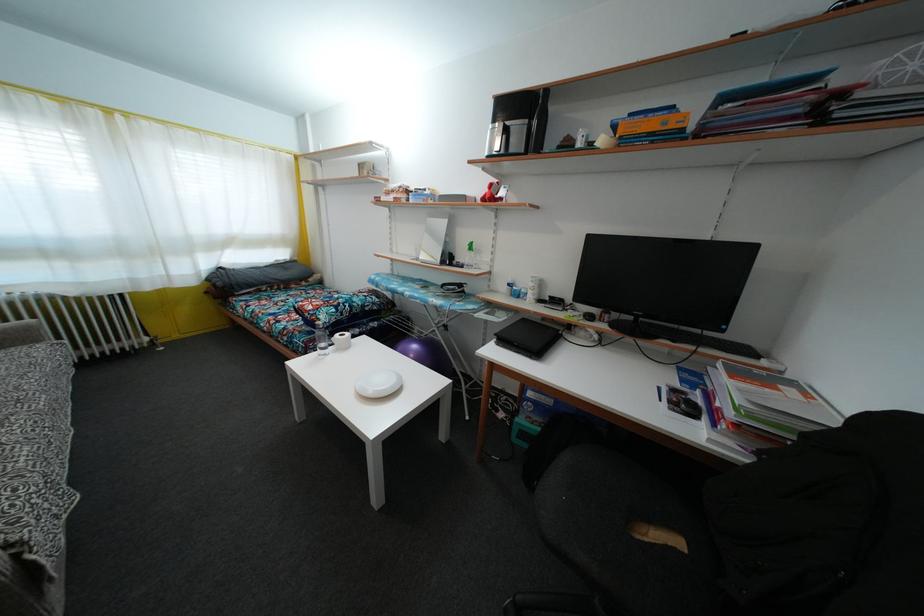
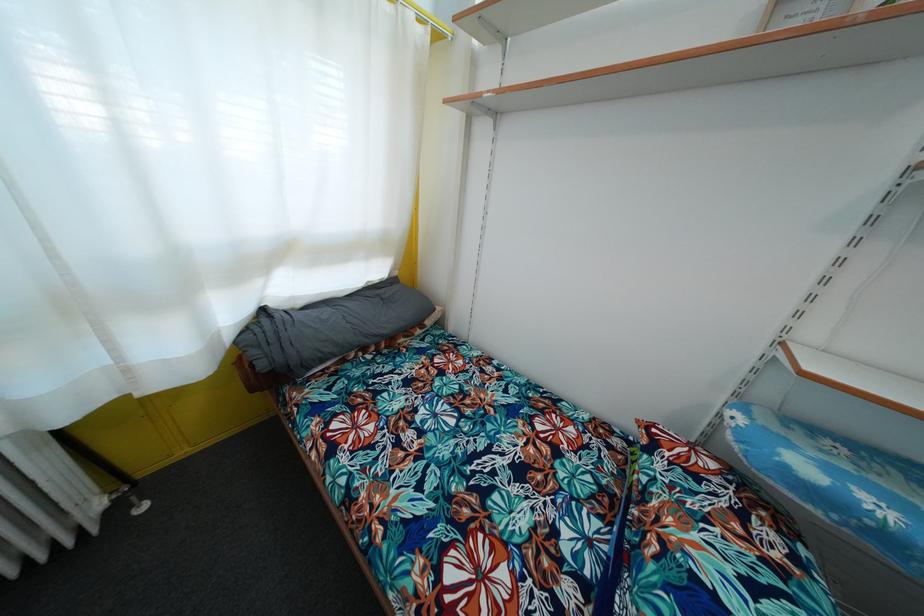
The images are taken continuously from a first-person perspective. In which direction are you moving?

The cameraman moved toward left, forward.